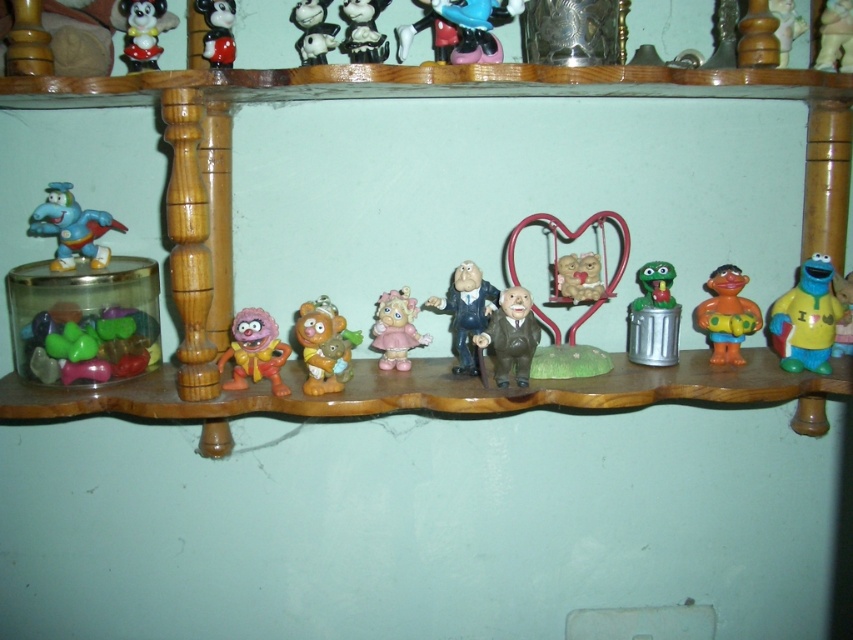
Which of these two, wooden shelf at center or orange rubber sesame street character at center, stands taller?

wooden shelf at center

Is wooden shelf at center taller than orange rubber sesame street character at center?

Yes, wooden shelf at center is taller than orange rubber sesame street character at center.

Locate an element on the screen. The height and width of the screenshot is (640, 853). wooden shelf at center is located at coordinates (405, 96).

Between point (799, 316) and point (728, 307), which one is positioned in front?

Point (799, 316) is in front.

Is point (799, 291) positioned in front of point (735, 292)?

Yes, it is.

This screenshot has width=853, height=640. What are the coordinates of `yellow matte cookie monster at right` in the screenshot? It's located at (805, 317).

Can you confirm if shiny plastic mickey mouse at upper center is bigger than yellow rubber sesame street character at center?

Correct, shiny plastic mickey mouse at upper center is larger in size than yellow rubber sesame street character at center.

Consider the image. Is shiny plastic mickey mouse at upper center below yellow rubber sesame street character at center?

No, shiny plastic mickey mouse at upper center is not below yellow rubber sesame street character at center.

Which is behind, point (225, 4) or point (837, 342)?

The point (837, 342) is behind.

Identify the location of shiny plastic mickey mouse at upper center. (218, 29).